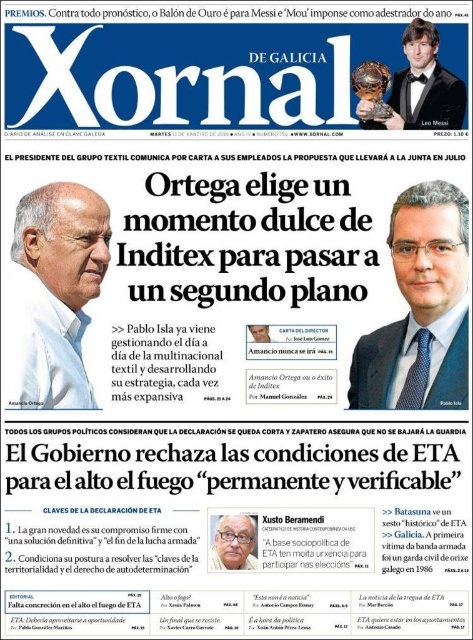
You are a reader looking at the front page of the newspaper. You see the matte black suit at right and the white matte face at upper left. Which object is positioned lower on the page?

The matte black suit at right is located below the white matte face at upper left, so the matte black suit at right is positioned lower on the page.

Consider the image. Based on the provided scene description, where is the matte black suit at right located in the image?

The matte black suit at right is located at point 2D coordinates of (420, 308).